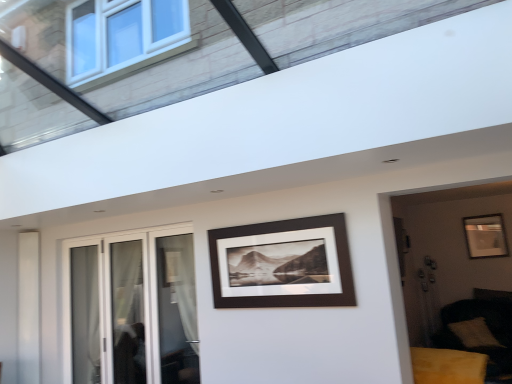
Question: Is matte black picture frame at center, the 1th picture frame from the left, to the right of yellow velvet sofa at lower right from the viewer's perspective?

Choices:
 (A) yes
 (B) no

Answer: (B)

Question: Is matte black picture frame at center, acting as the 2th picture frame starting from the back, wider than yellow velvet sofa at lower right?

Choices:
 (A) no
 (B) yes

Answer: (A)

Question: Can you confirm if matte black picture frame at center, acting as the 2th picture frame starting from the back, is bigger than yellow velvet sofa at lower right?

Choices:
 (A) no
 (B) yes

Answer: (A)

Question: From the image's perspective, is matte black picture frame at center, acting as the 2th picture frame starting from the back, under yellow velvet sofa at lower right?

Choices:
 (A) no
 (B) yes

Answer: (A)

Question: Are matte black picture frame at center, which ranks as the first picture frame in front-to-back order, and yellow velvet sofa at lower right far apart?

Choices:
 (A) yes
 (B) no

Answer: (A)

Question: Considering the positions of yellow velvet sofa at lower right and matte black picture frame at center, which is counted as the 2th picture frame, starting from the right, in the image, is yellow velvet sofa at lower right taller or shorter than matte black picture frame at center, which is counted as the 2th picture frame, starting from the right,?

Choices:
 (A) short
 (B) tall

Answer: (A)

Question: In terms of size, does yellow velvet sofa at lower right appear bigger or smaller than matte black picture frame at center, the 1th picture frame from the left?

Choices:
 (A) big
 (B) small

Answer: (A)

Question: Is yellow velvet sofa at lower right spatially inside matte black picture frame at center, the 1th picture frame from the left, or outside of it?

Choices:
 (A) inside
 (B) outside

Answer: (B)

Question: From the image's perspective, is yellow velvet sofa at lower right above or below matte black picture frame at center, the 1th picture frame from the left?

Choices:
 (A) below
 (B) above

Answer: (A)

Question: Considering the positions of yellow velvet sofa at lower right and soft beige cushion at lower right in the image, is yellow velvet sofa at lower right taller or shorter than soft beige cushion at lower right?

Choices:
 (A) tall
 (B) short

Answer: (B)

Question: Is yellow velvet sofa at lower right wider or thinner than soft beige cushion at lower right?

Choices:
 (A) wide
 (B) thin

Answer: (B)

Question: Choose the correct answer: Is yellow velvet sofa at lower right inside soft beige cushion at lower right or outside it?

Choices:
 (A) inside
 (B) outside

Answer: (B)

Question: From a real-world perspective, is yellow velvet sofa at lower right physically located above or below soft beige cushion at lower right?

Choices:
 (A) below
 (B) above

Answer: (B)

Question: Would you say matte black picture frame at right, which is the 2th picture frame from left to right, is to the left or to the right of white glass door at left in the picture?

Choices:
 (A) left
 (B) right

Answer: (B)

Question: Relative to white glass door at left, is matte black picture frame at right, which is the 2th picture frame from left to right, in front or behind?

Choices:
 (A) behind
 (B) front

Answer: (A)